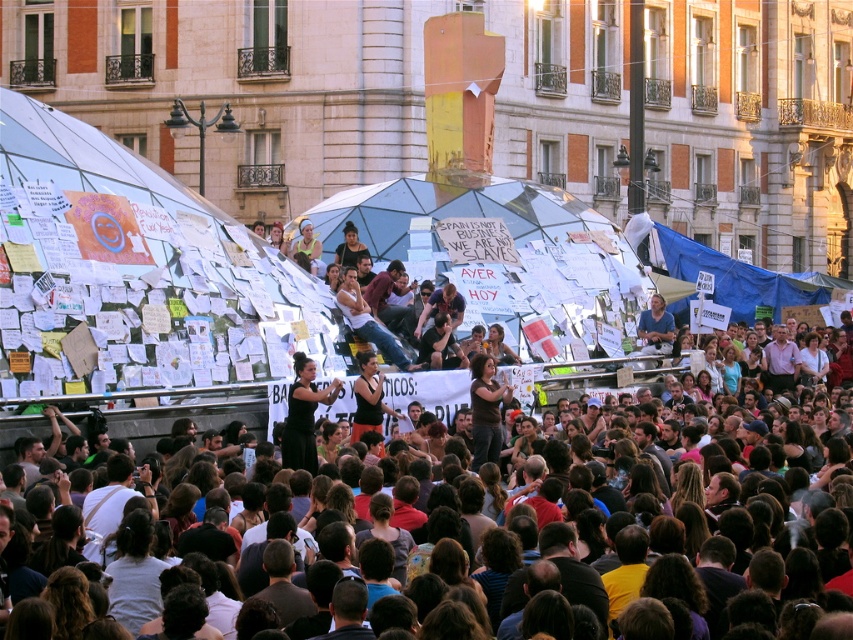
Question: Where is dark brown fabric at center located in relation to blue cotton shirt at center in the image?

Choices:
 (A) below
 (B) above

Answer: (A)

Question: Which of these objects is positioned farthest from the black dress at center?

Choices:
 (A) dark brown fabric at center
 (B) dark brown hair at center

Answer: (B)

Question: Can you confirm if black dress at center is smaller than dark brown fabric at center?

Choices:
 (A) yes
 (B) no

Answer: (A)

Question: Can you confirm if dark brown hair at center is smaller than blue cotton shirt at center?

Choices:
 (A) no
 (B) yes

Answer: (A)

Question: Which is farther from the blue cotton shirt at center?

Choices:
 (A) black dress at center
 (B) dark brown hair at center
 (C) dark brown fabric at center

Answer: (A)

Question: Which point is farther from the camera taking this photo?

Choices:
 (A) click(x=305, y=456)
 (B) click(x=282, y=387)
 (C) click(x=653, y=300)

Answer: (C)